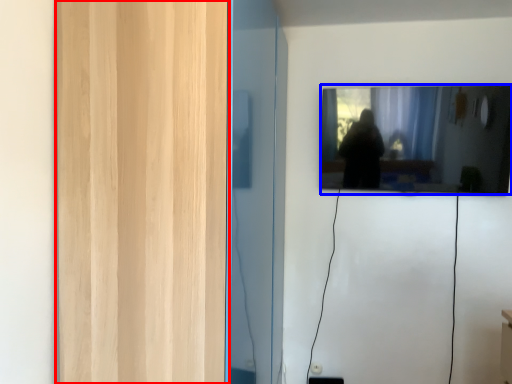
Question: Among these objects, which one is farthest to the camera, glass door (highlighted by a red box) or mirror (highlighted by a blue box)?

Choices:
 (A) glass door
 (B) mirror

Answer: (B)